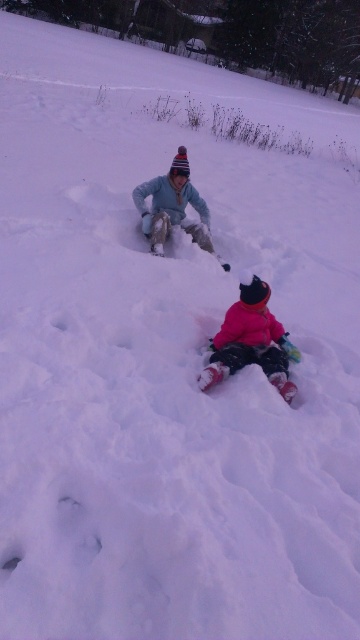
Does fluffy pink snowsuit at lower center have a greater height compared to light blue fabric snowsuit at center?

In fact, fluffy pink snowsuit at lower center may be shorter than light blue fabric snowsuit at center.

Is point (228, 326) positioned before point (199, 195)?

Yes, it is in front of point (199, 195).

Locate an element on the screen. The height and width of the screenshot is (640, 360). fluffy pink snowsuit at lower center is located at coordinates (250, 340).